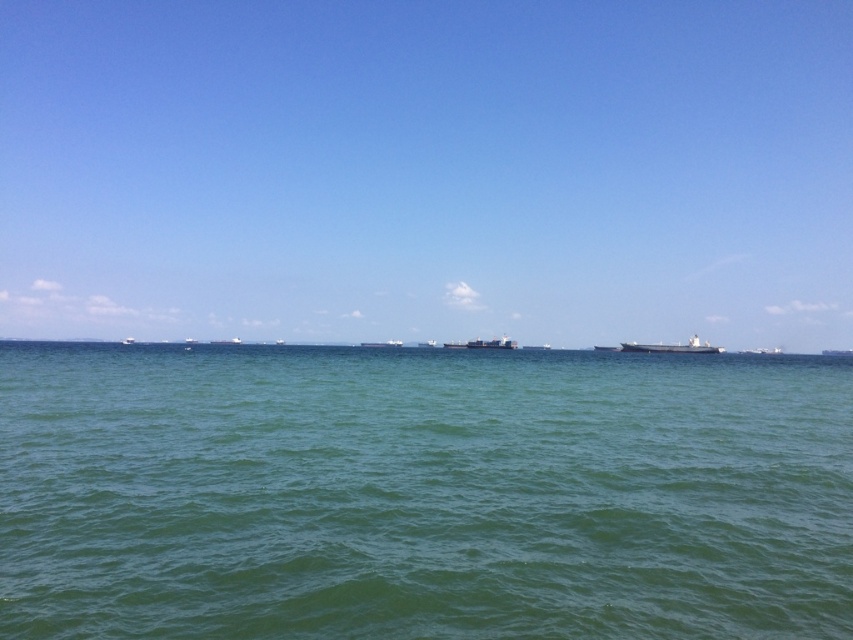
How much distance is there between metallic gray ship at right and metallic gray cargo ship at center?

38.72 meters

Can you confirm if metallic gray ship at right is positioned above metallic gray cargo ship at center?

Correct, metallic gray ship at right is located above metallic gray cargo ship at center.

Which is in front, point (624, 346) or point (502, 344)?

Point (624, 346) is in front.

Where is `metallic gray ship at right`? metallic gray ship at right is located at coordinates (672, 348).

Is green water at center closer to the viewer compared to metallic gray ship at right?

Yes.

This screenshot has height=640, width=853. Describe the element at coordinates (421, 493) in the screenshot. I see `green water at center` at that location.

Locate an element on the screen. The image size is (853, 640). green water at center is located at coordinates click(421, 493).

Is point (36, 490) positioned after point (483, 344)?

No, it is in front of (483, 344).

Can you confirm if green water at center is taller than metallic gray cargo ship at center?

No, green water at center is not taller than metallic gray cargo ship at center.

At what (x,y) coordinates should I click in order to perform the action: click on green water at center. Please return your answer as a coordinate pair (x, y). The width and height of the screenshot is (853, 640). Looking at the image, I should click on (421, 493).